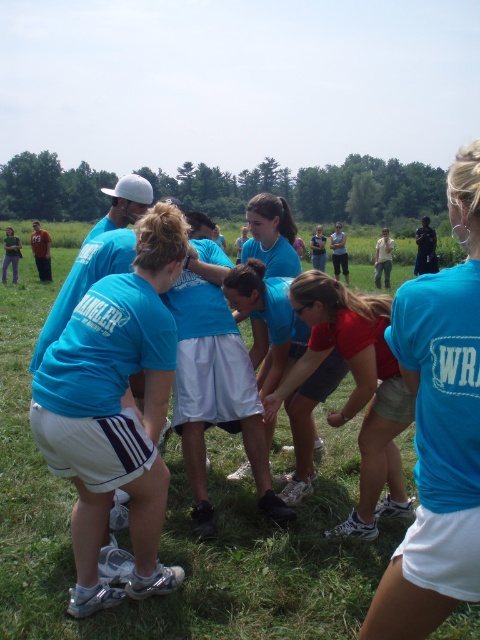
Between green grass at center and matte blue shirt at center, which one appears on the right side from the viewer's perspective?

matte blue shirt at center

Can you confirm if green grass at center is positioned to the right of matte blue shirt at center?

Incorrect, green grass at center is not on the right side of matte blue shirt at center.

Between point (382, 538) and point (455, 497), which one is positioned in front?

Point (455, 497)

Identify the location of green grass at center. (177, 518).

Between matte blue shirt at center and red matte shirt at center, which one has less height?

With less height is matte blue shirt at center.

Measure the distance between matte blue shirt at center and camera.

matte blue shirt at center is 5.08 feet away from camera.

Does point (479, 548) come behind point (354, 321)?

No, (479, 548) is in front of (354, 321).

This screenshot has height=640, width=480. In order to click on matte blue shirt at center in this screenshot , I will do 439,429.

Does green grass at center have a smaller size compared to red matte shirt at center?

No.

Is point (11, 328) positioned before point (348, 524)?

No, it is behind (348, 524).

Locate an element on the screen. The image size is (480, 640). green grass at center is located at coordinates (177, 518).